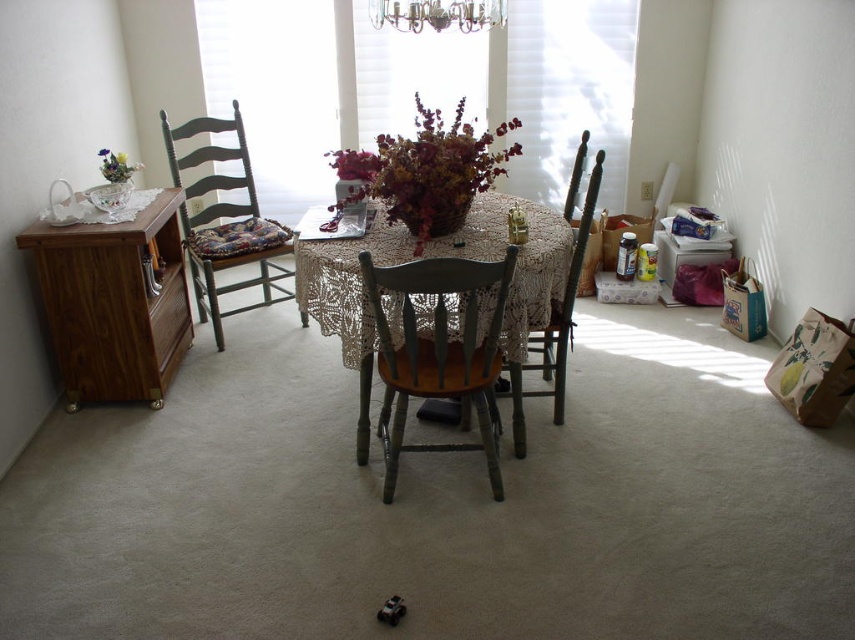
You are sitting at the round table in the dining area and want to move to the wooden chair at center. Which direction should you move relative to the wooden chair with cushion at left?

You should move to the right relative to the wooden chair with cushion at left to reach the wooden chair at center because the wooden chair with cushion at left is positioned to the left of the wooden chair at center.

You are standing at the center of the room and want to place a new vase on the brown wood cabinet at left. Based on its position, can you estimate how far it is from the center of the room?

The brown wood cabinet at left is positioned at coordinates point (115, 304), so it is located approximately 0.475 meters to the left and 0.135 meters forward from the center of the room.